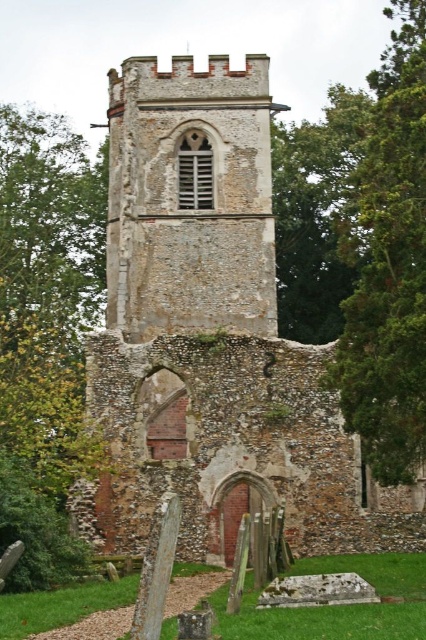
Question: Which of these objects is positioned farthest from the brown stone church at center?

Choices:
 (A) green coniferous tree at right
 (B) green leafy tree at left

Answer: (B)

Question: Considering the relative positions of brown stone church at center and green coniferous tree at right in the image provided, where is brown stone church at center located with respect to green coniferous tree at right?

Choices:
 (A) left
 (B) right

Answer: (A)

Question: Among these objects, which one is nearest to the camera?

Choices:
 (A) brown stone church at center
 (B) green leafy tree at left

Answer: (B)

Question: Is brown stone church at center thinner than green leafy tree at left?

Choices:
 (A) no
 (B) yes

Answer: (A)

Question: Among these objects, which one is nearest to the camera?

Choices:
 (A) green coniferous tree at right
 (B) brown stone church at center
 (C) green leafy tree at left

Answer: (A)

Question: Can you confirm if green leafy tree at left is positioned to the left of green coniferous tree at right?

Choices:
 (A) no
 (B) yes

Answer: (B)